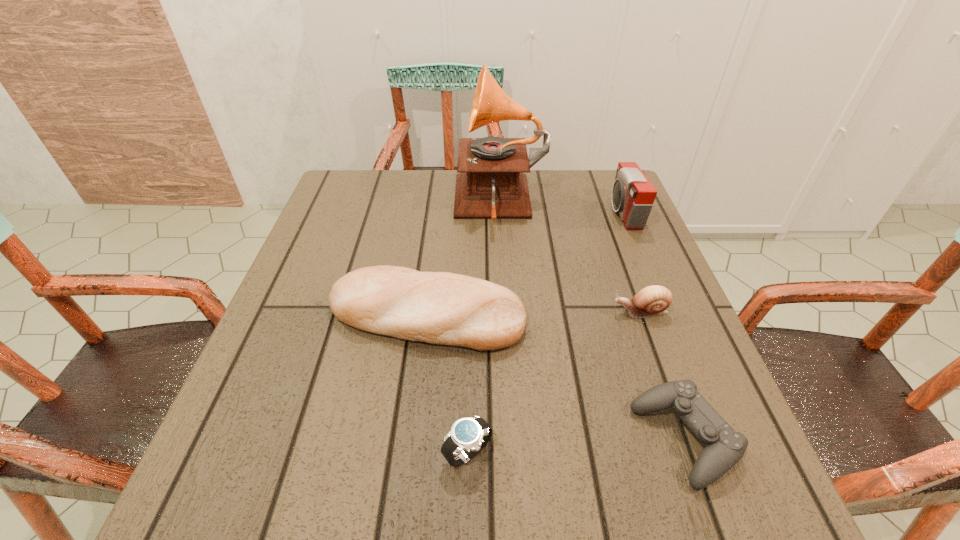
Locate an element on the screen. This screenshot has width=960, height=540. free area in between the escargot and the bread is located at coordinates (x=534, y=314).

Identify the location of blank region between the control and the fifth shortest object. The image size is (960, 540). (654, 325).

Locate an element on the screen. The image size is (960, 540). free space between the control and the tallest object is located at coordinates (592, 322).

You are a GUI agent. You are given a task and a screenshot of the screen. Output one action in this format:
    pyautogui.click(x=<x>, y=<y>)
    Task: Click on the object that is the fourth closest to the fourth shortest object
    This screenshot has height=540, width=960.
    Given the screenshot: What is the action you would take?
    pyautogui.click(x=651, y=301)

This screenshot has height=540, width=960. I want to click on object that can be found as the fifth closest to the escargot, so click(x=468, y=436).

Find the location of a particular element. vacant space that satisfies the following two spatial constraints: 1. on the front-facing side of the escargot; 2. on the front side of the shortest object is located at coordinates (685, 438).

Find the location of `free space that satisfies the following two spatial constraints: 1. on the horn of the phonograph record; 2. on the front side of the watch`. free space that satisfies the following two spatial constraints: 1. on the horn of the phonograph record; 2. on the front side of the watch is located at coordinates (515, 453).

The width and height of the screenshot is (960, 540). What are the coordinates of `vacant area in the image that satisfies the following two spatial constraints: 1. on the back side of the shortest object; 2. on the left side of the watch` in the screenshot? It's located at (468, 438).